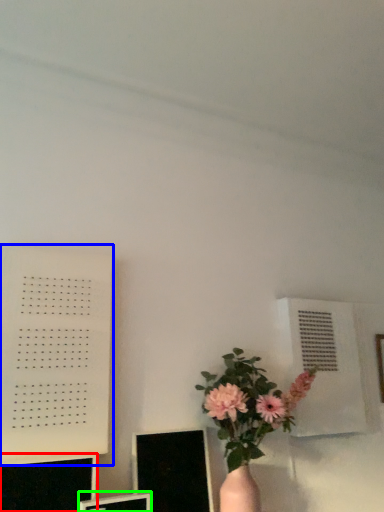
Question: Which is farther away from computer monitor (highlighted by a red box)? bulletin board (highlighted by a blue box) or computer monitor (highlighted by a green box)?

Choices:
 (A) bulletin board
 (B) computer monitor

Answer: (A)